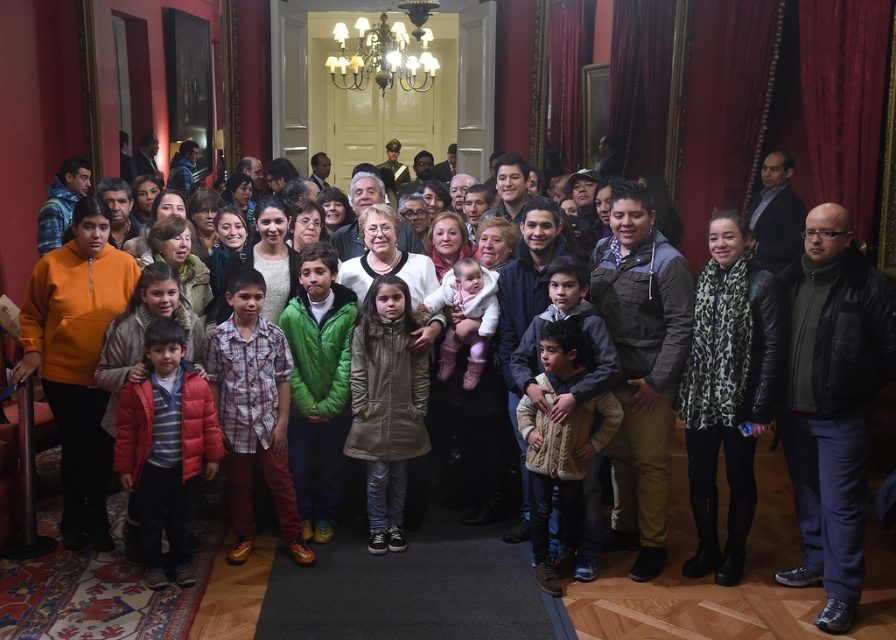
Question: Is matte red puffer jacket at lower left above white fluffy coat at center?

Choices:
 (A) no
 (B) yes

Answer: (A)

Question: Which point is farther to the camera?

Choices:
 (A) coord(191,371)
 (B) coord(376,298)
 (C) coord(537,493)

Answer: (B)

Question: Which point is farther to the camera?

Choices:
 (A) knitted beige sweater at center
 (B) matte red puffer jacket at lower left

Answer: (A)

Question: Can you confirm if matte red puffer jacket at lower left is positioned to the left of white fluffy coat at center?

Choices:
 (A) no
 (B) yes

Answer: (B)

Question: Is tan quilted coat at center further to the viewer compared to knitted beige sweater at center?

Choices:
 (A) no
 (B) yes

Answer: (B)

Question: Which object is positioned closest to the matte red puffer jacket at lower left?

Choices:
 (A) white fluffy coat at center
 (B) knitted beige sweater at center
 (C) tan quilted coat at center

Answer: (C)